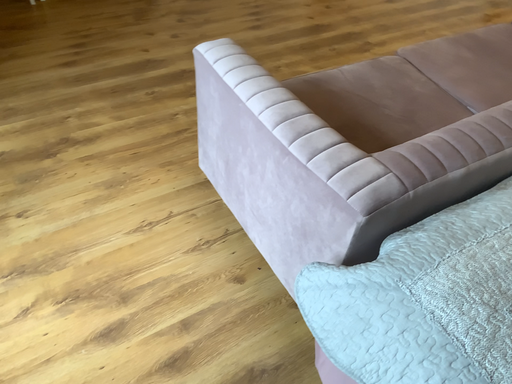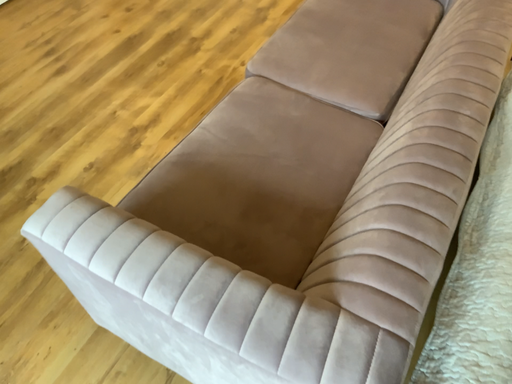
Question: How did the camera likely rotate when shooting the video?

Choices:
 (A) rotated left
 (B) rotated right

Answer: (B)